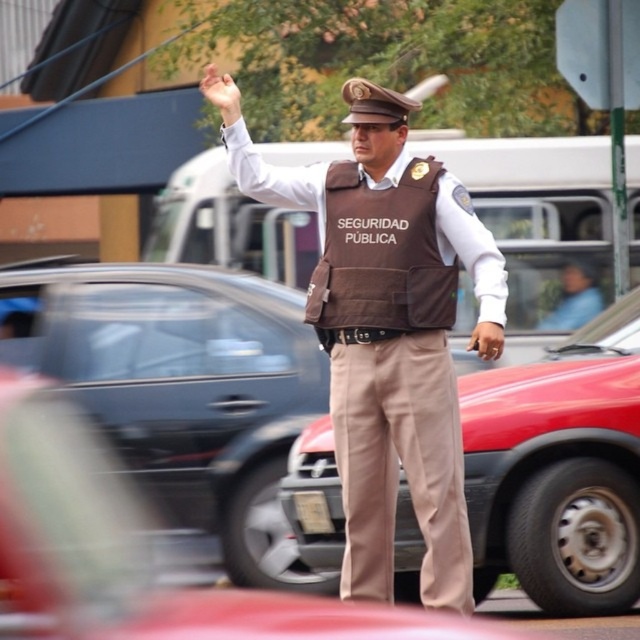
You are a pedestrian trying to cross the street and see the traffic officer. Which item of clothing from the officer is closer to the ground, the brown leather pants at center or the brown leather vest at center?

The brown leather pants at center is below the brown leather vest at center, so the brown leather pants at center is closer to the ground.

You are a drone operator trying to capture a photo of the traffic officer. You have two points marked in the image for focus. The first point is at coordinate point(545,388) and the second is at point(410,230). Which point should you focus on to ensure the traffic officer is in sharp focus?

You should focus on point(545,388) because it is closer to the camera than point(410,230), ensuring the traffic officer is in sharp focus.